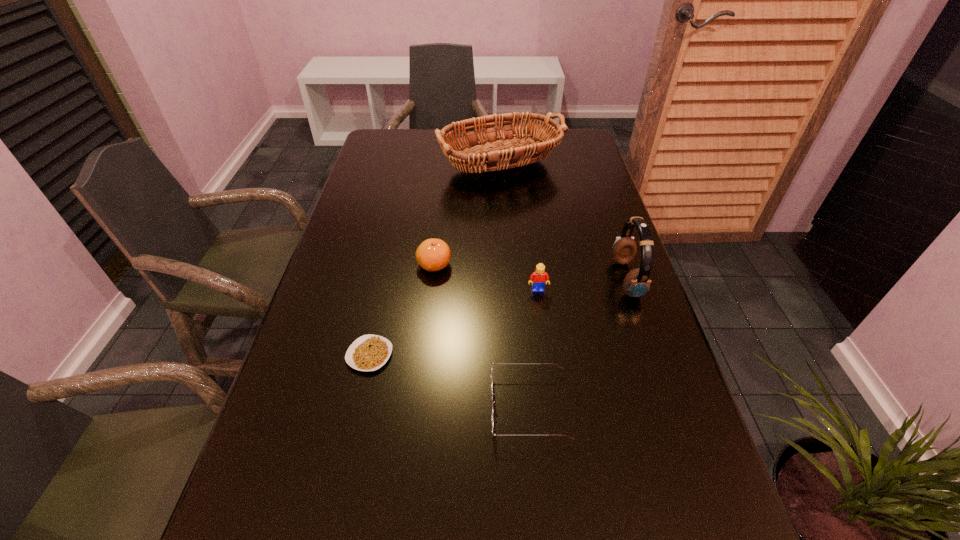
Image resolution: width=960 pixels, height=540 pixels. Identify the location of free space between the Lego and the basket. (515, 228).

The image size is (960, 540). Find the location of `blank region between the farthest object and the Lego`. blank region between the farthest object and the Lego is located at coordinates (515, 228).

Find the location of a particular element. vacant area that lies between the basket and the second shortest object is located at coordinates (511, 286).

Where is `vacant space that is in between the headset and the Lego`? Image resolution: width=960 pixels, height=540 pixels. vacant space that is in between the headset and the Lego is located at coordinates (583, 285).

You are a GUI agent. You are given a task and a screenshot of the screen. Output one action in this format:
    pyautogui.click(x=<x>, y=<y>)
    Task: Click on the object that can be found as the fourth closest to the third shortest object
    
    Given the screenshot: What is the action you would take?
    pyautogui.click(x=492, y=393)

Where is `object that can be found as the third closest to the Lego`? This screenshot has height=540, width=960. object that can be found as the third closest to the Lego is located at coordinates (492, 393).

Where is `free space that satisfies the following two spatial constraints: 1. on the back side of the shortest object; 2. on the right side of the basket`? free space that satisfies the following two spatial constraints: 1. on the back side of the shortest object; 2. on the right side of the basket is located at coordinates click(x=411, y=166).

Identify the location of free space that satisfies the following two spatial constraints: 1. on the front-facing side of the Lego; 2. on the front-facing side of the fifth tallest object. This screenshot has width=960, height=540. (553, 406).